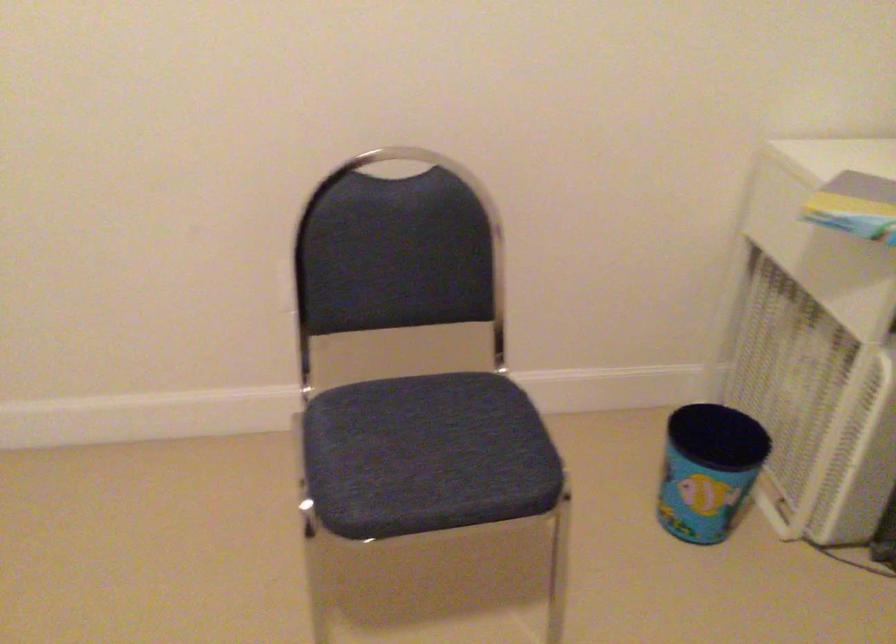
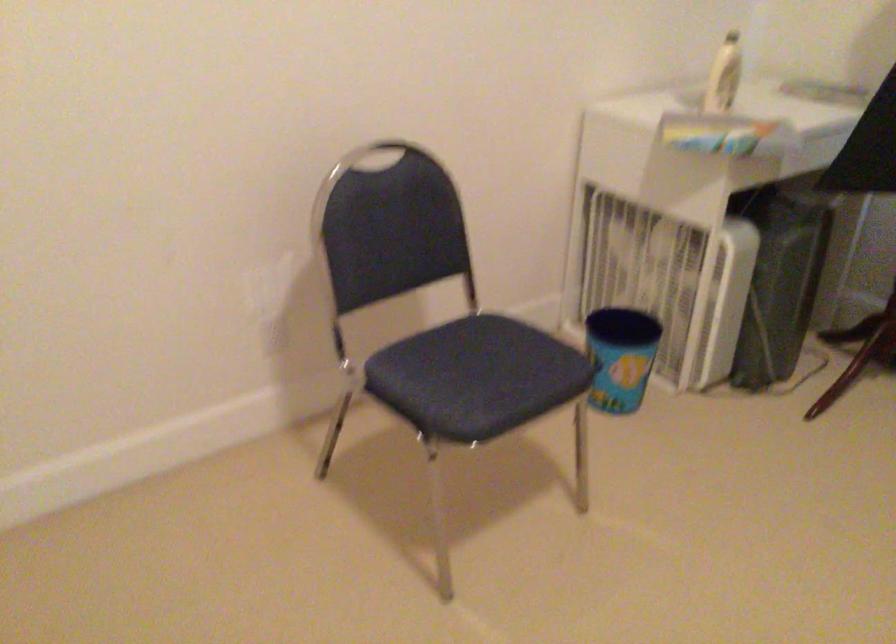
Locate, in the second image, the point that corresponds to point (426, 453) in the first image.

(476, 377)